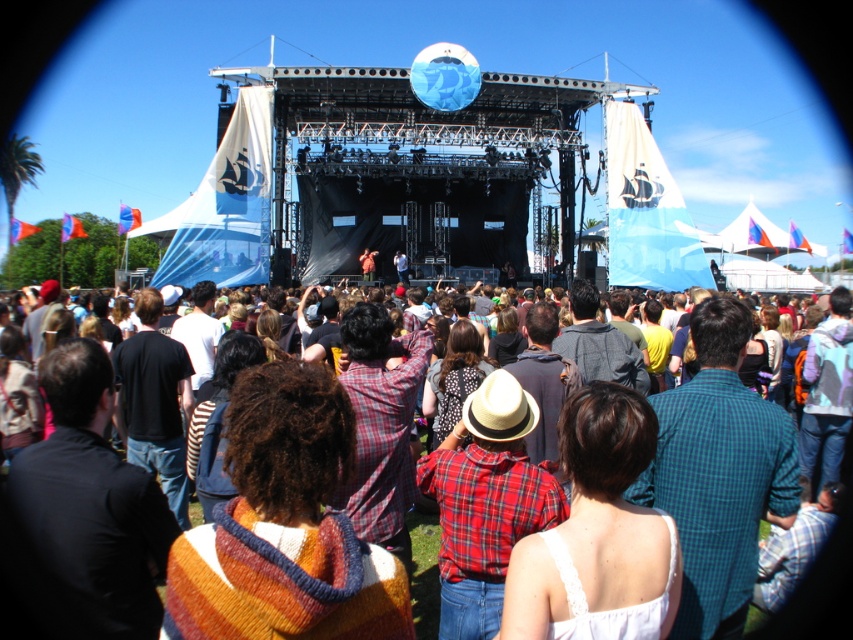
Question: Is plaid shirt at center thinner than white felt cowboy hat at center?

Choices:
 (A) yes
 (B) no

Answer: (B)

Question: Can you confirm if plaid shirt at center is positioned to the right of white felt cowboy hat at center?

Choices:
 (A) no
 (B) yes

Answer: (A)

Question: Which point appears closest to the camera in this image?

Choices:
 (A) (25, 611)
 (B) (485, 401)

Answer: (A)

Question: In this image, where is plaid shirt at center located relative to white felt cowboy hat at center?

Choices:
 (A) left
 (B) right

Answer: (A)

Question: Which of the following is the farthest from the observer?

Choices:
 (A) plaid shirt at center
 (B) white felt cowboy hat at center

Answer: (B)